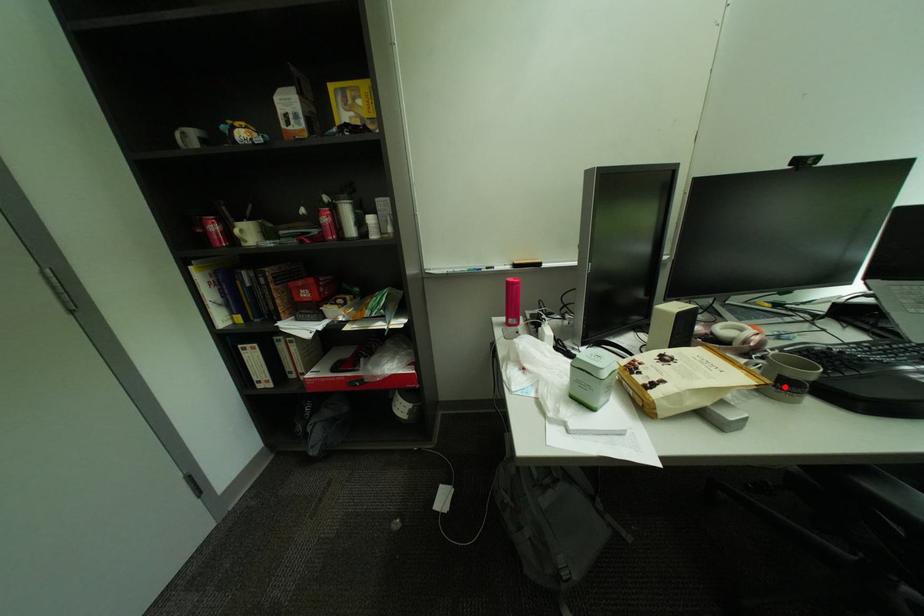
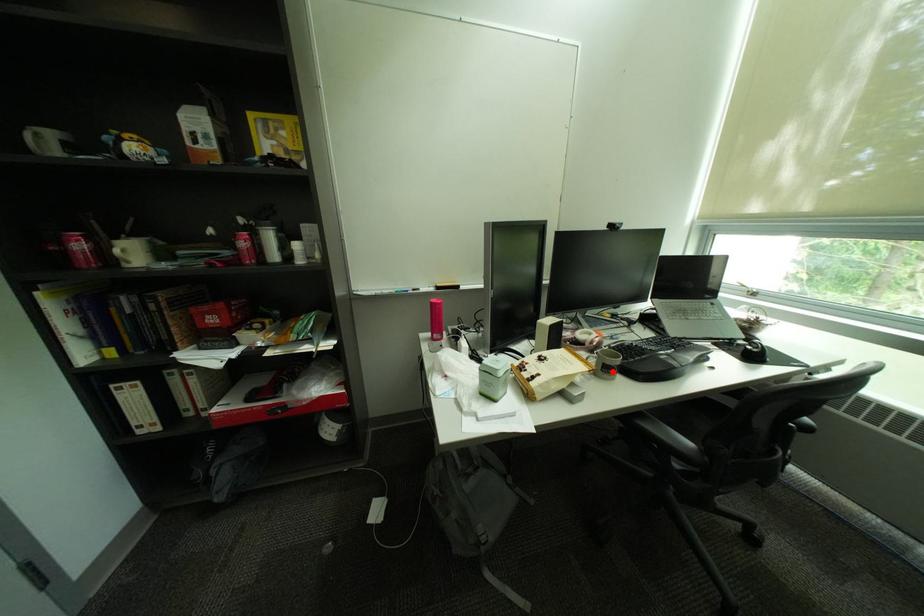
Looking at this image, I am providing you with two images of the same scene from different viewpoints. A red point is marked on the first image and another point is marked on the second image. Is the marked point in image1 the same physical position as the marked point in image2?

Yes